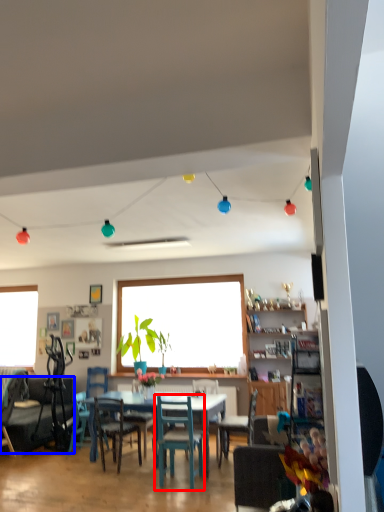
Question: Which of the following is the farthest to the observer, chair (highlighted by a red box) or studio couch (highlighted by a blue box)?

Choices:
 (A) chair
 (B) studio couch

Answer: (B)